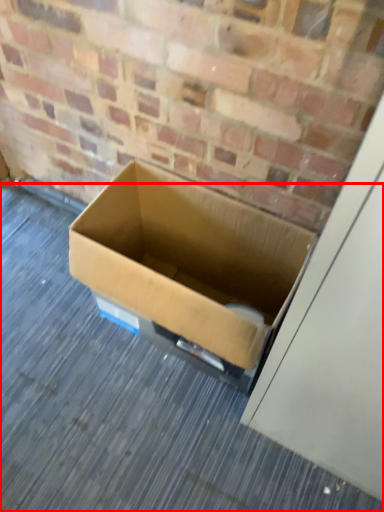
Question: Considering the relative positions of alley (annotated by the red box) and box in the image provided, where is alley (annotated by the red box) located with respect to the staircase?

Choices:
 (A) left
 (B) right

Answer: (A)